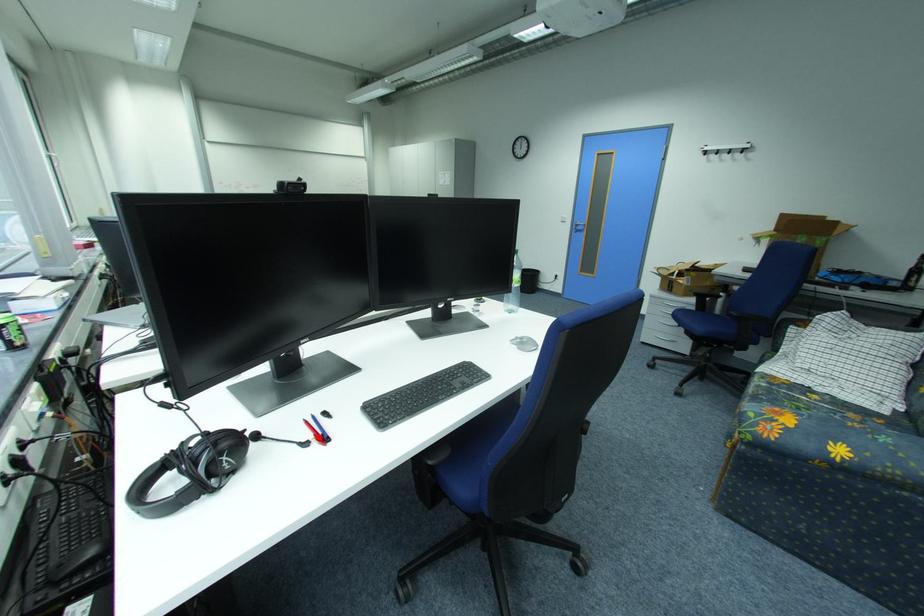
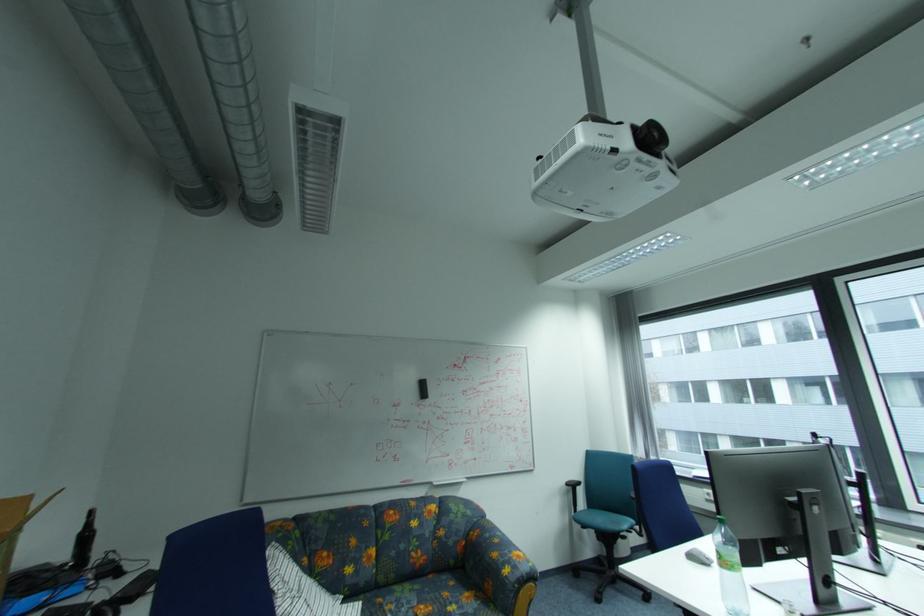
Question: I am providing you with two images of the same scene from different viewpoints. A red point is marked on the first image. Can you still see the location of the red point in image 2?

Choices:
 (A) Yes
 (B) No

Answer: (B)